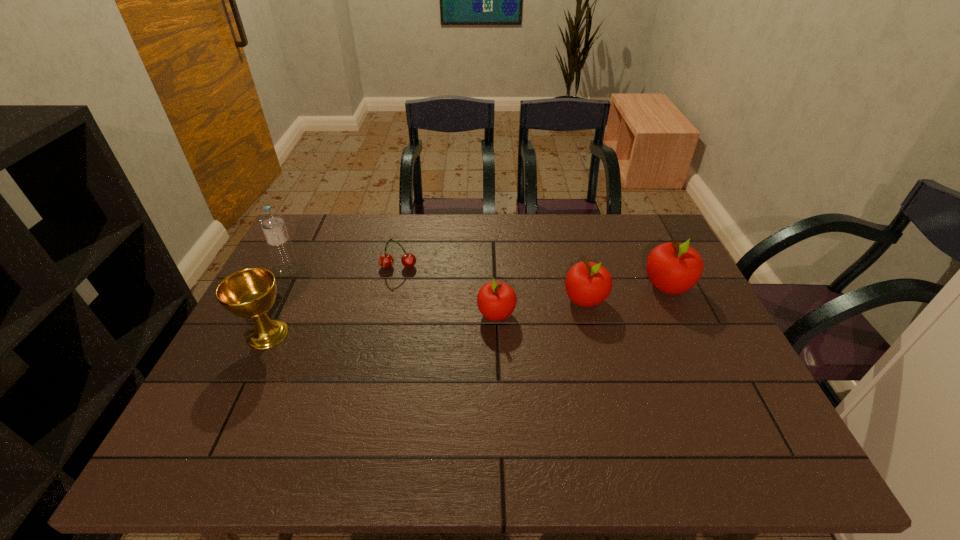
Image resolution: width=960 pixels, height=540 pixels. Find the location of `free space at the right edge`. free space at the right edge is located at coordinates (692, 370).

The height and width of the screenshot is (540, 960). What are the coordinates of `free space at the far left corner of the desktop` in the screenshot? It's located at (327, 245).

The height and width of the screenshot is (540, 960). What are the coordinates of `free space at the far right corner of the desktop` in the screenshot? It's located at (653, 231).

This screenshot has height=540, width=960. I want to click on free space at the near right corner, so click(x=697, y=417).

At what (x,y) coordinates should I click in order to perform the action: click on free point between the second apple from left to right and the tallest object. Please return your answer as a coordinate pair (x, y). The width and height of the screenshot is (960, 540). Looking at the image, I should click on (437, 286).

Find the location of a particular element. The image size is (960, 540). vacant region between the tallest object and the chalice is located at coordinates (278, 302).

Identify the location of empty location between the shortest apple and the cherry. Image resolution: width=960 pixels, height=540 pixels. (447, 291).

Find the location of a particular element. free spot between the water bottle and the rightmost apple is located at coordinates (479, 279).

Find the location of a particular element. vacant area between the water bottle and the leftmost apple is located at coordinates (393, 293).

Where is `empty location between the chalice and the water bottle`? The height and width of the screenshot is (540, 960). empty location between the chalice and the water bottle is located at coordinates (278, 302).